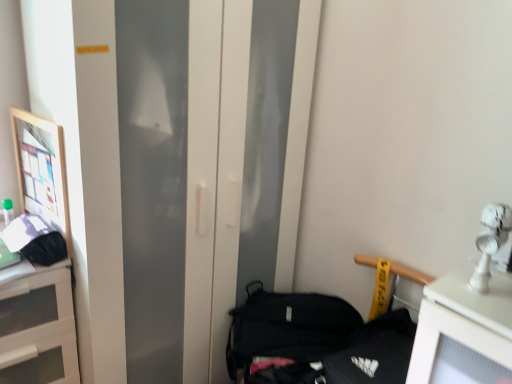
Question: Is white matte cabinet at left oriented away from wooden framed picture at left?

Choices:
 (A) no
 (B) yes

Answer: (A)

Question: From the image's perspective, is white matte cabinet at left beneath wooden framed picture at left?

Choices:
 (A) yes
 (B) no

Answer: (A)

Question: From a real-world perspective, is white matte cabinet at left located beneath wooden framed picture at left?

Choices:
 (A) yes
 (B) no

Answer: (A)

Question: Is white matte cabinet at left smaller than wooden framed picture at left?

Choices:
 (A) no
 (B) yes

Answer: (A)

Question: Is white matte cabinet at left positioned in front of wooden framed picture at left?

Choices:
 (A) yes
 (B) no

Answer: (A)

Question: Can you confirm if white matte cabinet at left is wider than wooden framed picture at left?

Choices:
 (A) yes
 (B) no

Answer: (A)

Question: Is matte black handbag at left, marked as the first handbag in a left-to-right arrangement, outside white matte cabinet at left?

Choices:
 (A) no
 (B) yes

Answer: (B)

Question: Does matte black handbag at left, marked as the first handbag in a left-to-right arrangement, have a smaller size compared to white matte cabinet at left?

Choices:
 (A) yes
 (B) no

Answer: (A)

Question: From a real-world perspective, is matte black handbag at left, the 1th handbag viewed from the top, positioned over white matte cabinet at left based on gravity?

Choices:
 (A) yes
 (B) no

Answer: (A)

Question: Does matte black handbag at left, which is the second handbag in right-to-left order, have a greater width compared to white matte cabinet at left?

Choices:
 (A) no
 (B) yes

Answer: (A)

Question: Does matte black handbag at left, the 1th handbag viewed from the top, appear on the left side of white matte cabinet at left?

Choices:
 (A) yes
 (B) no

Answer: (B)

Question: From a real-world perspective, is matte black handbag at left, the 1th handbag viewed from the top, located beneath white matte cabinet at left?

Choices:
 (A) no
 (B) yes

Answer: (A)

Question: From the image's perspective, would you say matte black handbag at left, the 1th handbag viewed from the top, is positioned over black fabric handbag at lower right, the second handbag in the top-to-bottom sequence?

Choices:
 (A) yes
 (B) no

Answer: (A)